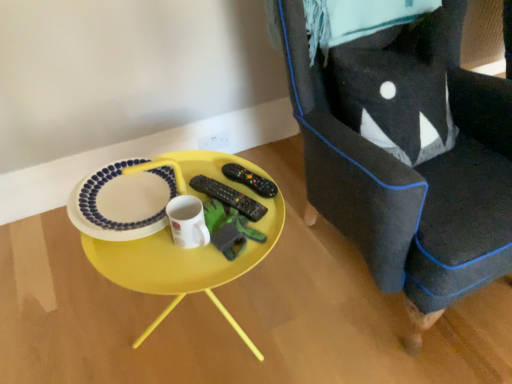
I want to click on vacant area to the right of yellow plastic table at center, so click(330, 307).